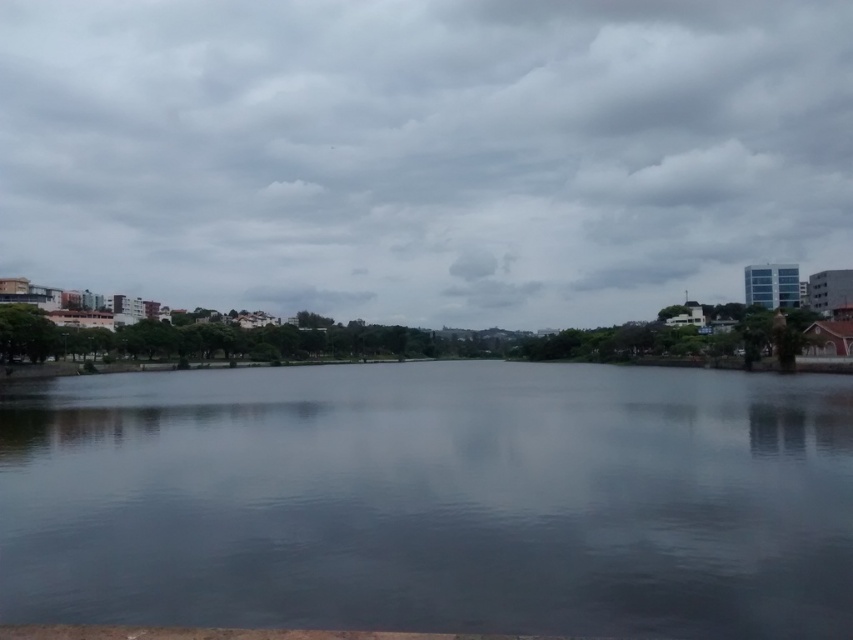
Is cloudy sky at upper center bigger than smooth water at center?

Correct, cloudy sky at upper center is larger in size than smooth water at center.

Describe the element at coordinates (424, 154) in the screenshot. I see `cloudy sky at upper center` at that location.

You are a GUI agent. You are given a task and a screenshot of the screen. Output one action in this format:
    pyautogui.click(x=<x>, y=<y>)
    Task: Click on the cloudy sky at upper center
    This screenshot has height=640, width=853.
    Given the screenshot: What is the action you would take?
    pyautogui.click(x=424, y=154)